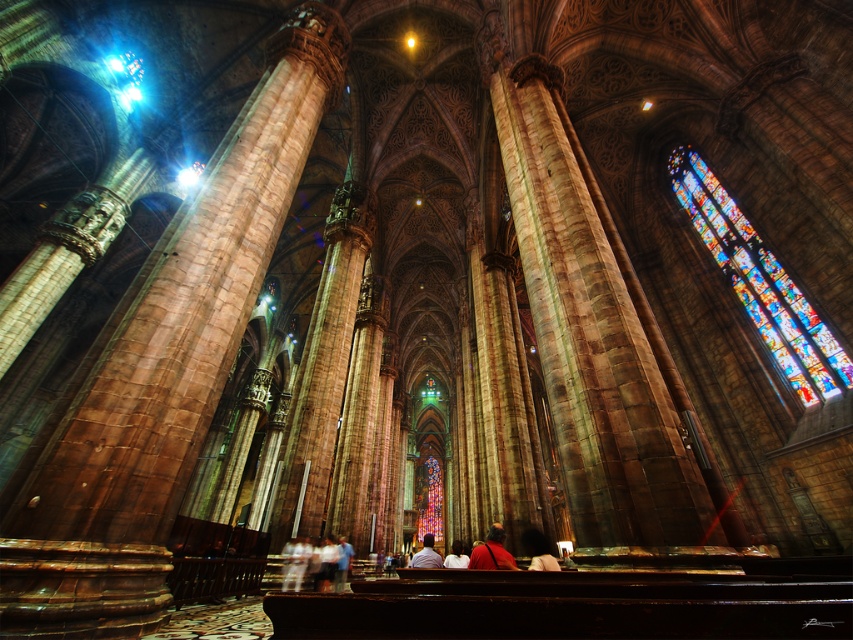
Does point (802, 300) come behind point (529, 540)?

Yes, point (802, 300) is farther from viewer.

Is stained glass at upper right further to the viewer compared to smooth brown leather bag at lower center?

Yes, stained glass at upper right is further from the viewer.

What do you see at coordinates (759, 284) in the screenshot? I see `stained glass at upper right` at bounding box center [759, 284].

You are a GUI agent. You are given a task and a screenshot of the screen. Output one action in this format:
    pyautogui.click(x=<x>, y=<y>)
    Task: Click on the stained glass at upper right
    The width and height of the screenshot is (853, 640).
    Given the screenshot: What is the action you would take?
    pyautogui.click(x=759, y=284)

From the picture: Between matte red shirt at center and smooth brown leather bag at lower center, which one is positioned lower?

Positioned lower is matte red shirt at center.

How far apart are matte red shirt at center and smooth brown leather bag at lower center?

matte red shirt at center is 17.67 feet from smooth brown leather bag at lower center.

Between point (480, 554) and point (538, 532), which one is positioned in front?

Positioned in front is point (480, 554).

The width and height of the screenshot is (853, 640). What are the coordinates of `matte red shirt at center` in the screenshot? It's located at (491, 552).

Between stained glass at upper right and light brown leather jacket at center, which one is positioned lower?

Positioned lower is light brown leather jacket at center.

Who is shorter, stained glass at upper right or light brown leather jacket at center?

With less height is stained glass at upper right.

You are a GUI agent. You are given a task and a screenshot of the screen. Output one action in this format:
    pyautogui.click(x=<x>, y=<y>)
    Task: Click on the stained glass at upper right
    This screenshot has height=640, width=853.
    Given the screenshot: What is the action you would take?
    pyautogui.click(x=759, y=284)

Identify the location of stained glass at upper right. The height and width of the screenshot is (640, 853). (759, 284).